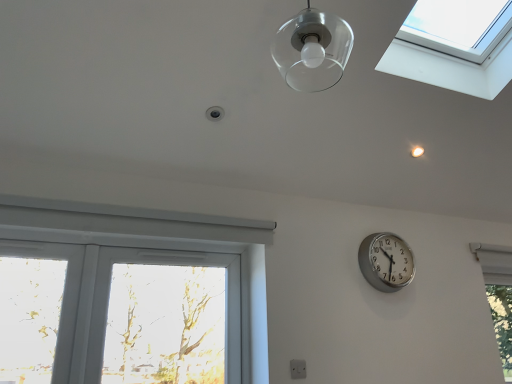
Question: Is transparent glass droplight at upper center to the left or to the right of white plastic electric outlet at lower center in the image?

Choices:
 (A) right
 (B) left

Answer: (B)

Question: Considering the positions of transparent glass droplight at upper center and white plastic electric outlet at lower center in the image, is transparent glass droplight at upper center wider or thinner than white plastic electric outlet at lower center?

Choices:
 (A) wide
 (B) thin

Answer: (A)

Question: Which of these objects is positioned closest to the silver metallic clock at right?

Choices:
 (A) white plastic window at lower left
 (B) clear glass lampshade at upper center
 (C) transparent glass window at lower right, the second window from the top
 (D) transparent glass window at upper right, placed as the second window when sorted from back to front
 (E) white plastic electric outlet at lower center

Answer: (E)

Question: Considering the real-world distances, which object is closest to the transparent glass window at lower right, which is the second window in left-to-right order?

Choices:
 (A) white plastic electric outlet at lower center
 (B) transparent glass droplight at upper center
 (C) silver metallic clock at right
 (D) clear glass lampshade at upper center
 (E) white plastic window at lower left

Answer: (C)